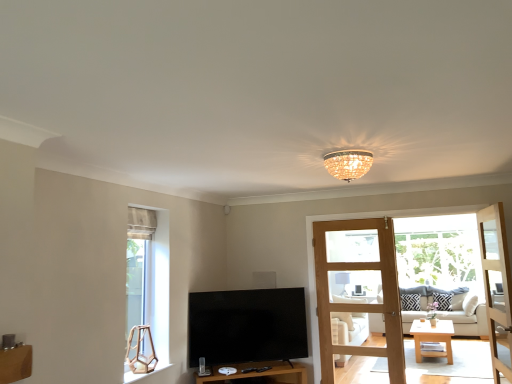
Question: Should I look upward or downward to see light brown wooden door at right, acting as the 2th door starting from the back?

Choices:
 (A) up
 (B) down

Answer: (B)

Question: From a real-world perspective, does black glossy tv at center stand above white fabric studio couch at center?

Choices:
 (A) yes
 (B) no

Answer: (A)

Question: From the image's perspective, is black glossy tv at center located beneath white fabric studio couch at center?

Choices:
 (A) no
 (B) yes

Answer: (A)

Question: Is white fabric studio couch at center located within black glossy tv at center?

Choices:
 (A) yes
 (B) no

Answer: (B)

Question: Is black glossy tv at center at the left side of white fabric studio couch at center?

Choices:
 (A) no
 (B) yes

Answer: (B)

Question: Considering the relative sizes of black glossy tv at center and white fabric studio couch at center in the image provided, is black glossy tv at center smaller than white fabric studio couch at center?

Choices:
 (A) no
 (B) yes

Answer: (B)

Question: Is black glossy tv at center outside white fabric studio couch at center?

Choices:
 (A) no
 (B) yes

Answer: (B)

Question: Is white fabric studio couch at center positioned with its back to matte black speaker at center?

Choices:
 (A) no
 (B) yes

Answer: (A)

Question: Are white fabric studio couch at center and matte black speaker at center far apart?

Choices:
 (A) no
 (B) yes

Answer: (B)

Question: From a real-world perspective, is white fabric studio couch at center on matte black speaker at center?

Choices:
 (A) no
 (B) yes

Answer: (A)

Question: Is matte black speaker at center located within white fabric studio couch at center?

Choices:
 (A) yes
 (B) no

Answer: (B)

Question: Does white fabric studio couch at center have a greater width compared to matte black speaker at center?

Choices:
 (A) no
 (B) yes

Answer: (B)

Question: From the image's perspective, does white fabric studio couch at center appear higher than matte black speaker at center?

Choices:
 (A) no
 (B) yes

Answer: (A)

Question: Considering the relative positions of matte black speaker at center and white fabric studio couch at center in the image provided, is matte black speaker at center to the right of white fabric studio couch at center from the viewer's perspective?

Choices:
 (A) yes
 (B) no

Answer: (B)